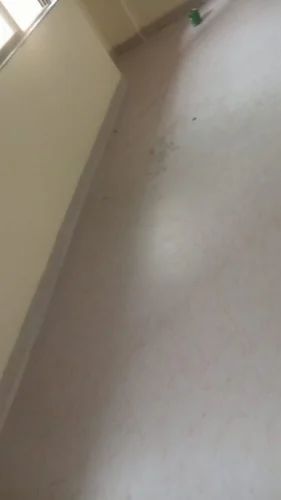
Locate an element on the screen. The width and height of the screenshot is (281, 500). ledge is located at coordinates (44, 16), (12, 48).